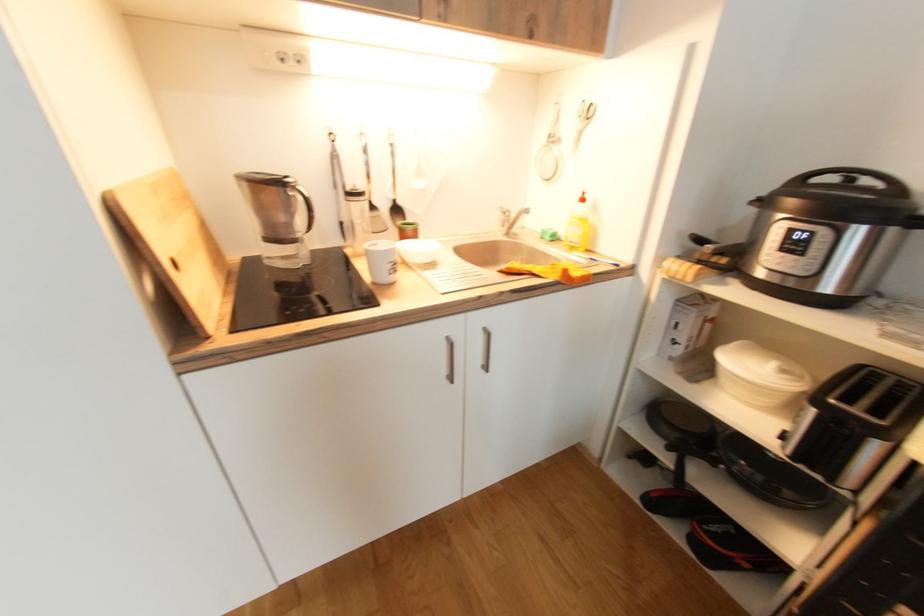
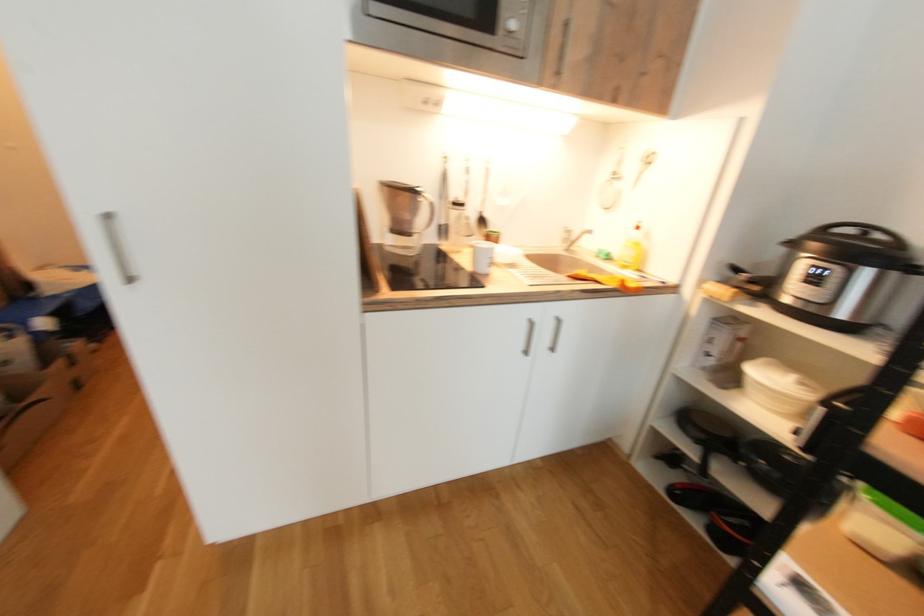
Question: The images are taken continuously from a first-person perspective. In which direction is your viewpoint rotating?

Choices:
 (A) Left
 (B) Right
 (C) Up
 (D) Down

Answer: (A)